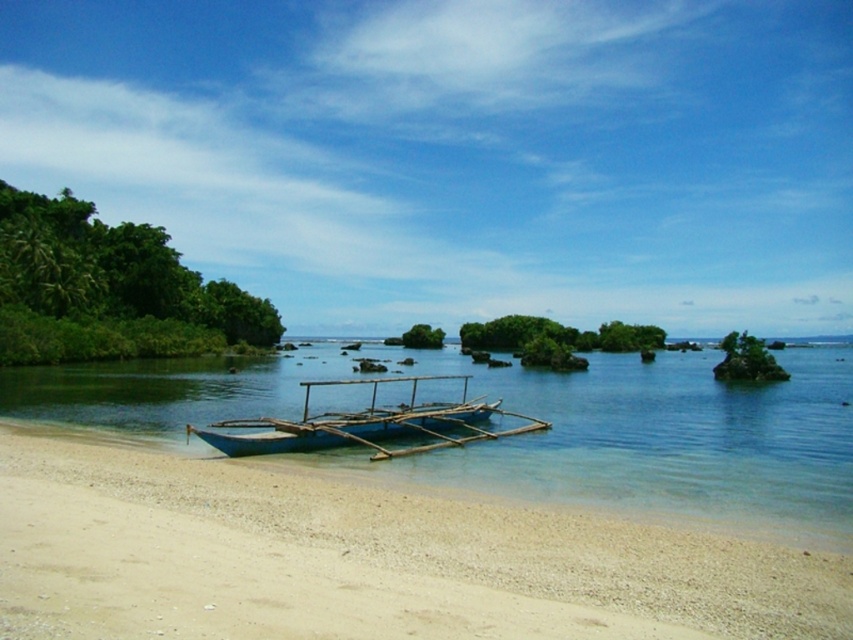
Question: Does white sandy beach at lower left have a lesser width compared to blue wooden boat at center?

Choices:
 (A) yes
 (B) no

Answer: (B)

Question: Does white sandy beach at lower left have a larger size compared to blue wooden boat at center?

Choices:
 (A) yes
 (B) no

Answer: (B)

Question: Which object appears farthest from the camera in this image?

Choices:
 (A) white sandy beach at lower left
 (B) blue wooden water at center
 (C) blue wooden boat at center

Answer: (C)

Question: Which point is closer to the camera?

Choices:
 (A) blue wooden boat at center
 (B) white sandy beach at lower left

Answer: (B)

Question: Which point is farther from the camera taking this photo?

Choices:
 (A) (508, 586)
 (B) (250, 394)
 (C) (368, 413)

Answer: (B)

Question: Considering the relative positions of blue wooden water at center and blue wooden boat at center in the image provided, where is blue wooden water at center located with respect to blue wooden boat at center?

Choices:
 (A) left
 (B) right

Answer: (B)